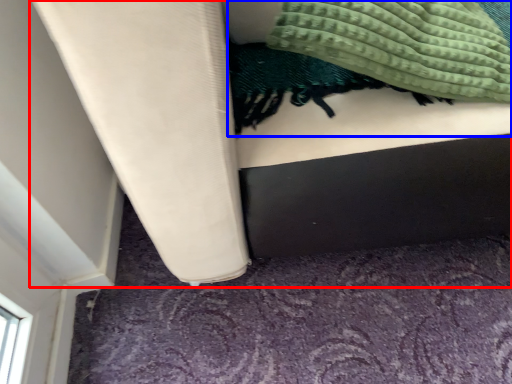
Question: Which object appears closest to the camera in this image, furniture (highlighted by a red box) or blanket (highlighted by a blue box)?

Choices:
 (A) furniture
 (B) blanket

Answer: (A)